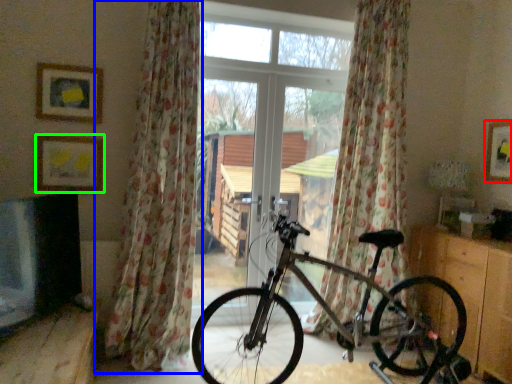
Question: Which object is the closest to the picture frame (highlighted by a red box)? Choose among these: curtain (highlighted by a blue box) or picture frame (highlighted by a green box).

Choices:
 (A) curtain
 (B) picture frame

Answer: (A)